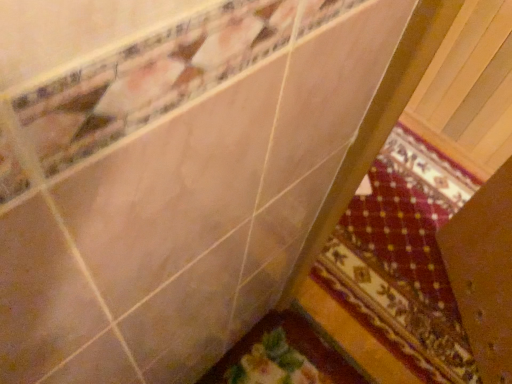
Where is `floral carpet at lower right`? Image resolution: width=512 pixels, height=384 pixels. floral carpet at lower right is located at coordinates (400, 267).

What is the approximate width of floral carpet at lower right?

floral carpet at lower right is 1.00 meters wide.

The image size is (512, 384). Describe the element at coordinates (400, 267) in the screenshot. I see `floral carpet at lower right` at that location.

The height and width of the screenshot is (384, 512). In order to click on floral carpet at lower right in this screenshot , I will do `click(400, 267)`.